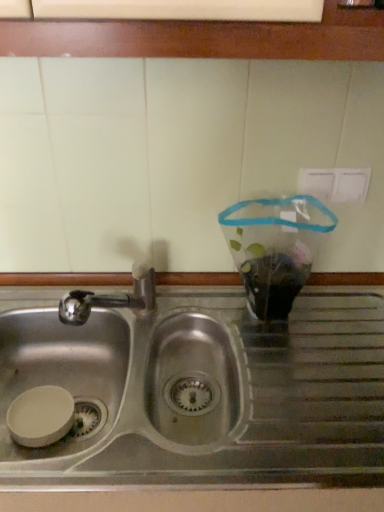
Find the location of a particular element. The width and height of the screenshot is (384, 512). vacant space situated above metallic sink at lower center (from a real-world perspective) is located at coordinates (172, 268).